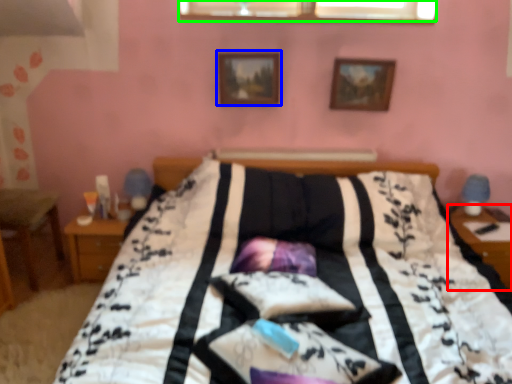
Question: Which object is positioned closest to table (highlighted by a red box)? Select from picture frame (highlighted by a blue box) and window (highlighted by a green box).

Choices:
 (A) picture frame
 (B) window

Answer: (B)